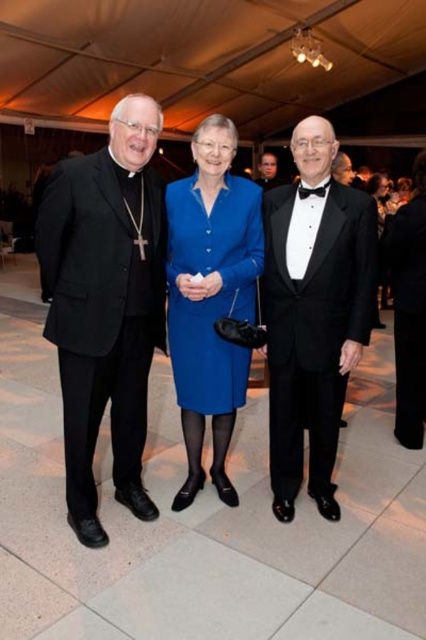
Question: Which object is closer to the camera taking this photo?

Choices:
 (A) black satin tuxedo at center
 (B) black satin bow tie at center
 (C) black matte suit at left

Answer: (C)

Question: Can you confirm if matte black suit at center is positioned to the right of black satin bow tie at center?

Choices:
 (A) yes
 (B) no

Answer: (B)

Question: Can you confirm if black satin tuxedo at center is positioned above black satin tuxedo at right?

Choices:
 (A) no
 (B) yes

Answer: (A)

Question: Considering the real-world distances, which object is farthest from the black matte suit at left?

Choices:
 (A) black satin tuxedo at right
 (B) black satin tuxedo at center
 (C) matte blue dress at center

Answer: (A)

Question: Is the position of black matte suit at left less distant than that of black satin tuxedo at right?

Choices:
 (A) yes
 (B) no

Answer: (A)

Question: Based on their relative distances, which object is farther from the smooth black suit at center?

Choices:
 (A) black satin tuxedo at right
 (B) matte black suit at center
 (C) black satin bow tie at center
 (D) black matte suit at left

Answer: (C)